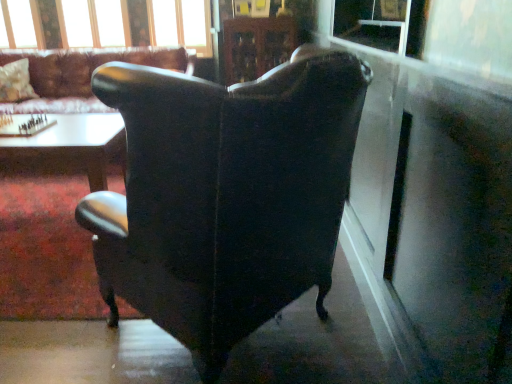
Find the location of `empty space that is ontop of wooden chessboard at center`. empty space that is ontop of wooden chessboard at center is located at coordinates (22, 128).